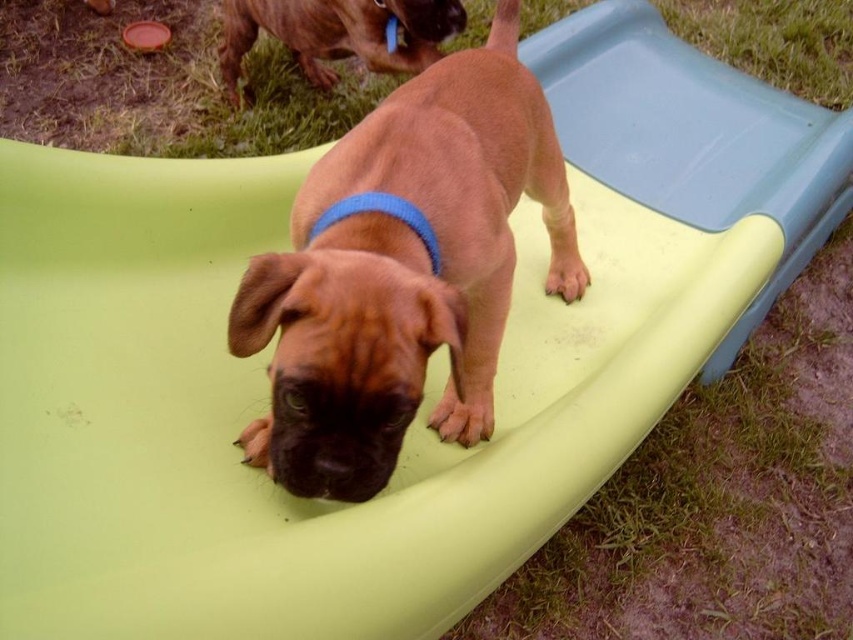
You are a dog trainer observing the scene. You see the brown matte dog at center and the brown glossy dog at upper center. Which dog is closer to the right edge of the slide?

The brown matte dog at center is positioned on the right side of brown glossy dog at upper center, so the brown matte dog at center is closer to the right edge of the slide.

You are a photographer standing at a certain distance from the brown matte dog at center. You want to take a closeup shot of the dog without moving your position. Is the current distance sufficient for a standard camera lens with a maximum zoom of 200mm?

The distance between the brown matte dog at center and the camera is 38.91 inches. A standard camera lens with a maximum zoom of 200mm can focus on subjects at this distance, so yes, the current distance is sufficient for a closeup shot.

You are a dog trainer observing the scene. You notice two dogs in the image. Which dog is bigger, the brown matte dog at center or the brown glossy dog at upper center?

The brown matte dog at center is larger in size compared to the brown glossy dog at upper center according to the description.